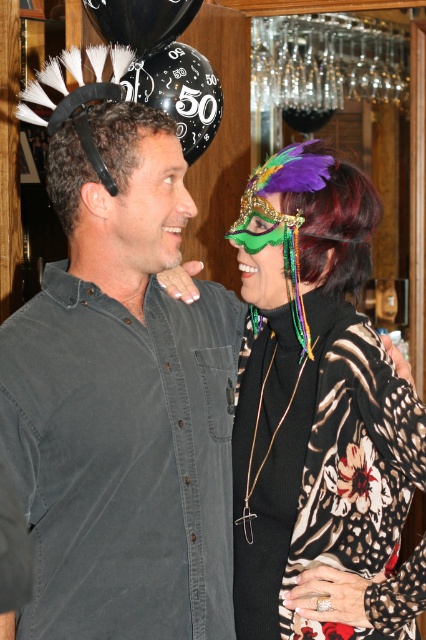
You are a photographer at a party and need to adjust the camera focus. The dark gray shirt at center and the shiny green mask at center are part of the same scene. How far apart are these two items in centimeters?

The dark gray shirt at center and the shiny green mask at center are 29.34 centimeters apart.